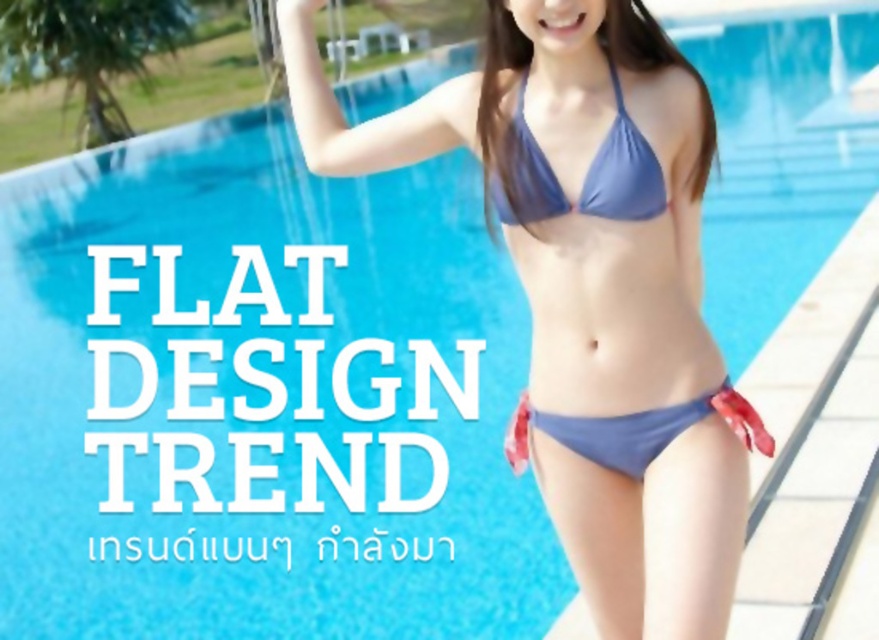
Question: Which of the following is the farthest from the observer?

Choices:
 (A) blue fabric bikini at upper right
 (B) blue fabric bikini at center
 (C) matte blue bikini top at center

Answer: (B)

Question: Among these points, which one is nearest to the camera?

Choices:
 (A) (599, 552)
 (B) (654, 156)
 (C) (525, 83)

Answer: (B)

Question: Is blue fabric bikini at center smaller than matte blue bikini top at center?

Choices:
 (A) yes
 (B) no

Answer: (B)

Question: Among these points, which one is farthest from the camera?

Choices:
 (A) (596, 214)
 (B) (611, 132)

Answer: (B)

Question: Does blue fabric bikini at upper right have a larger size compared to blue fabric bikini at center?

Choices:
 (A) no
 (B) yes

Answer: (B)

Question: Can you confirm if blue fabric bikini at upper right is thinner than blue fabric bikini at center?

Choices:
 (A) yes
 (B) no

Answer: (B)